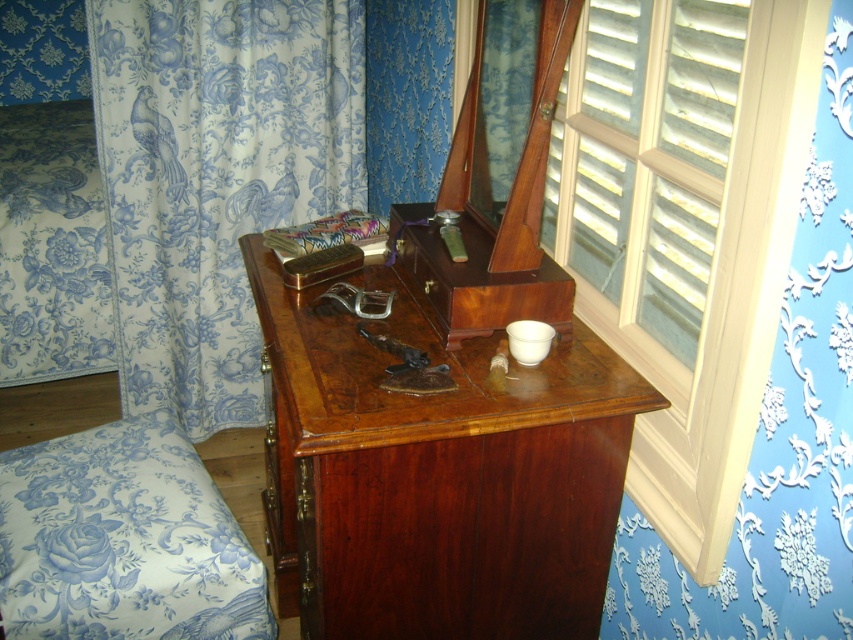
Question: Which point is closer to the camera taking this photo?

Choices:
 (A) (315, 221)
 (B) (711, 403)
 (C) (189, 497)

Answer: (B)

Question: Which of the following is the farthest from the observer?

Choices:
 (A) silky multicolored pillow at center
 (B) blue printed fabric at left
 (C) wooden shutters at right

Answer: (B)

Question: Can you confirm if blue floral fabric armchair at lower left is positioned to the right of silky multicolored pillow at center?

Choices:
 (A) yes
 (B) no

Answer: (B)

Question: Does wooden shutters at right appear over silky multicolored pillow at center?

Choices:
 (A) no
 (B) yes

Answer: (A)

Question: Is wooden shutters at right above silky multicolored pillow at center?

Choices:
 (A) no
 (B) yes

Answer: (A)

Question: Which point is closer to the camera?

Choices:
 (A) (161, 4)
 (B) (703, 200)

Answer: (B)